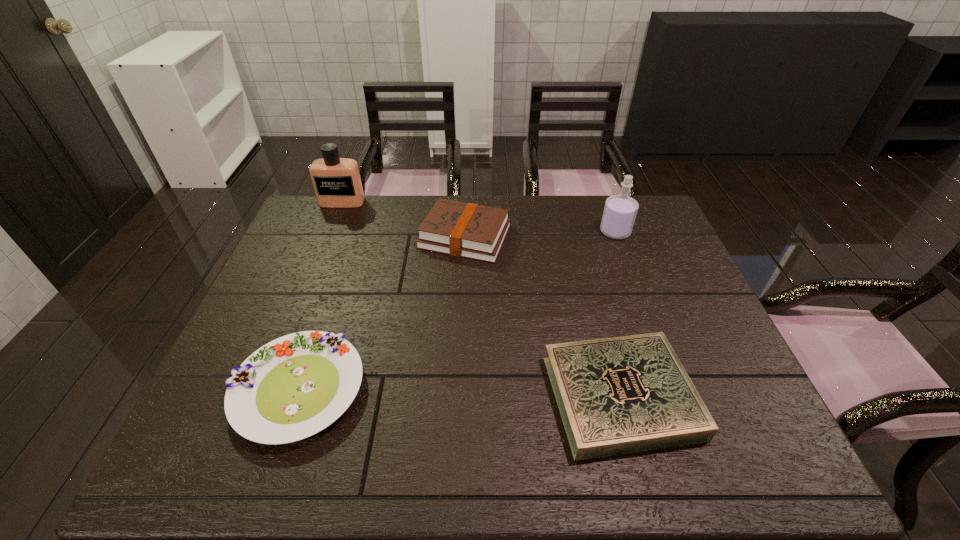
You are a GUI agent. You are given a task and a screenshot of the screen. Output one action in this format:
    pyautogui.click(x=<x>, y=<y>)
    Task: Click on the left perfume
    The image size is (960, 540).
    Given the screenshot: What is the action you would take?
    pyautogui.click(x=337, y=183)

The image size is (960, 540). I want to click on the farthest object, so click(x=337, y=183).

Where is `the right perfume`? The height and width of the screenshot is (540, 960). the right perfume is located at coordinates (620, 211).

Where is `the left hardback book`? The width and height of the screenshot is (960, 540). the left hardback book is located at coordinates (468, 230).

Where is `the taller hardback book`? The height and width of the screenshot is (540, 960). the taller hardback book is located at coordinates (468, 230).

You are a GUI agent. You are given a task and a screenshot of the screen. Output one action in this format:
    pyautogui.click(x=<x>, y=<y>)
    Task: Click on the right hardback book
    Image resolution: width=960 pixels, height=540 pixels.
    Given the screenshot: What is the action you would take?
    pyautogui.click(x=618, y=395)

The height and width of the screenshot is (540, 960). What are the coordinates of `the nearer hardback book` in the screenshot? It's located at (618, 395).

Find the location of a particular element. This screenshot has height=540, width=960. salad plate is located at coordinates (293, 387).

This screenshot has height=540, width=960. What are the coordinates of `free region located 0.340m on the front label of the left perfume` in the screenshot? It's located at 313,274.

I want to click on vacant area situated on the front of the right perfume, so click(630, 271).